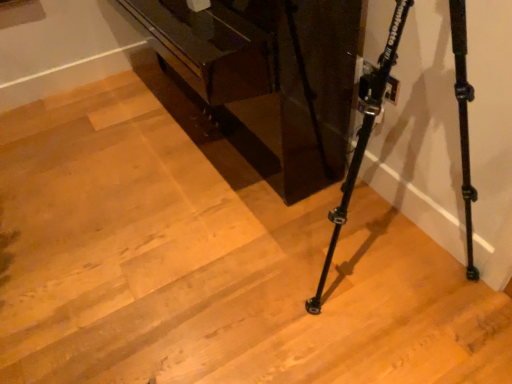
Where is `glossy dark wood piano at center`? glossy dark wood piano at center is located at coordinates (267, 79).

Describe the element at coordinates (267, 79) in the screenshot. The image size is (512, 384). I see `glossy dark wood piano at center` at that location.

In order to face black matte tripod at lower right, should I rotate leftwards or rightwards?

To align with it, rotate right about 16.346°.

The width and height of the screenshot is (512, 384). Describe the element at coordinates (362, 134) in the screenshot. I see `black matte tripod at lower right` at that location.

I want to click on black matte tripod at lower right, so click(362, 134).

You are a GUI agent. You are given a task and a screenshot of the screen. Output one action in this format:
    pyautogui.click(x=<x>, y=<y>)
    Task: Click on the glossy dark wood piano at center
    The height and width of the screenshot is (384, 512).
    Given the screenshot: What is the action you would take?
    pyautogui.click(x=267, y=79)

Considering the positions of objects glossy dark wood piano at center and black matte tripod at lower right in the image provided, who is more to the left, glossy dark wood piano at center or black matte tripod at lower right?

glossy dark wood piano at center is more to the left.

Which object is further away from the camera taking this photo, glossy dark wood piano at center or black matte tripod at lower right?

glossy dark wood piano at center is further from the camera.

Is point (190, 34) closer to viewer compared to point (362, 90)?

That is False.

From the image's perspective, which one is positioned higher, glossy dark wood piano at center or black matte tripod at lower right?

From the image's view, glossy dark wood piano at center is above.

Consider the image. From a real-world perspective, relative to black matte tripod at lower right, is glossy dark wood piano at center vertically above or below?

From a real-world perspective, glossy dark wood piano at center is physically below black matte tripod at lower right.

Between glossy dark wood piano at center and black matte tripod at lower right, which one has larger width?

glossy dark wood piano at center.

Is glossy dark wood piano at center taller than black matte tripod at lower right?

No.

Considering the relative sizes of glossy dark wood piano at center and black matte tripod at lower right in the image provided, is glossy dark wood piano at center smaller than black matte tripod at lower right?

Incorrect, glossy dark wood piano at center is not smaller in size than black matte tripod at lower right.

Does glossy dark wood piano at center contain black matte tripod at lower right?

That's incorrect, black matte tripod at lower right is not inside glossy dark wood piano at center.

Is the surface of glossy dark wood piano at center in direct contact with black matte tripod at lower right?

glossy dark wood piano at center and black matte tripod at lower right are clearly separated.

Could you tell me if glossy dark wood piano at center is turned towards black matte tripod at lower right?

No, glossy dark wood piano at center is not turned towards black matte tripod at lower right.

How different are the orientations of glossy dark wood piano at center and black matte tripod at lower right in degrees?

0.00011 degrees.

This screenshot has width=512, height=384. I want to click on furniture behind the black matte tripod at lower right, so click(267, 79).

Which object is positioned more to the right, black matte tripod at lower right or glossy dark wood piano at center?

black matte tripod at lower right is more to the right.

Considering their positions, is black matte tripod at lower right located in front of or behind glossy dark wood piano at center?

In the image, black matte tripod at lower right appears in front of glossy dark wood piano at center.

Which is less distant, [362,90] or [294,151]?

Point [362,90] is positioned closer to the camera compared to point [294,151].

From the image's perspective, is black matte tripod at lower right located above or below glossy dark wood piano at center?

black matte tripod at lower right is situated lower than glossy dark wood piano at center in the image.

From a real-world perspective, does black matte tripod at lower right stand above glossy dark wood piano at center?

Correct, in the physical world, black matte tripod at lower right is higher than glossy dark wood piano at center.

Considering the relative sizes of black matte tripod at lower right and glossy dark wood piano at center in the image provided, is black matte tripod at lower right wider than glossy dark wood piano at center?

In fact, black matte tripod at lower right might be narrower than glossy dark wood piano at center.

From their relative heights in the image, would you say black matte tripod at lower right is taller or shorter than glossy dark wood piano at center?

In the image, black matte tripod at lower right appears to be taller than glossy dark wood piano at center.

Does black matte tripod at lower right have a smaller size compared to glossy dark wood piano at center?

Yes.

Is black matte tripod at lower right outside of glossy dark wood piano at center?

That's correct, black matte tripod at lower right is outside of glossy dark wood piano at center.

Is black matte tripod at lower right next to glossy dark wood piano at center and touching it?

They are not placed beside each other.

Is black matte tripod at lower right aimed at glossy dark wood piano at center?

No, black matte tripod at lower right is not aimed at glossy dark wood piano at center.

Measure the distance between black matte tripod at lower right and glossy dark wood piano at center.

The distance of black matte tripod at lower right from glossy dark wood piano at center is 17.52 inches.

Find the location of a particular element. Image resolution: width=512 pixels, height=384 pixels. furniture above the black matte tripod at lower right (from the image's perspective) is located at coordinates pos(267,79).

Where is `furniture behind the black matte tripod at lower right`? The image size is (512, 384). furniture behind the black matte tripod at lower right is located at coordinates (267, 79).

This screenshot has width=512, height=384. I want to click on tripod in front of the glossy dark wood piano at center, so click(362, 134).